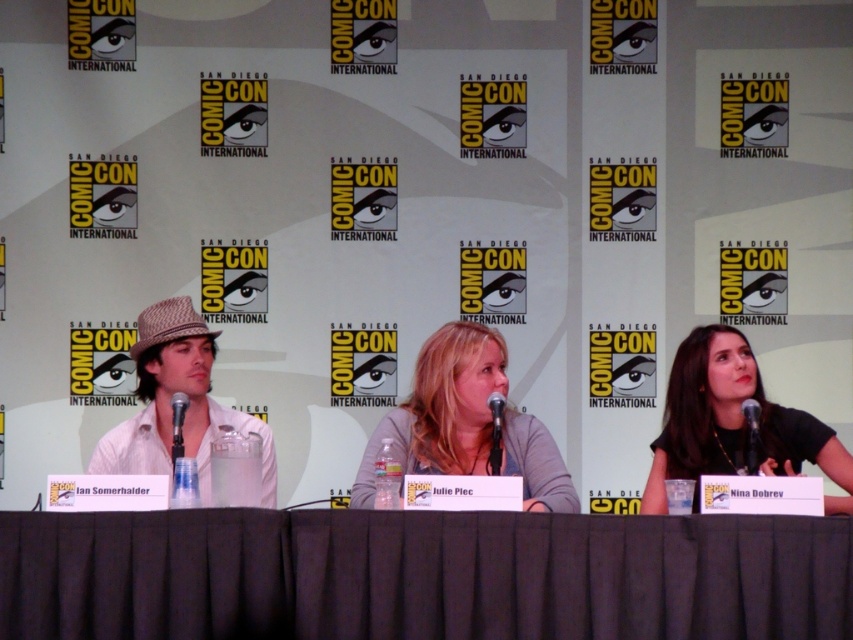
Can you confirm if dark fabric table at center is positioned to the right of light gray shirt at center?

In fact, dark fabric table at center is to the left of light gray shirt at center.

Where is `dark fabric table at center`? dark fabric table at center is located at coordinates (421, 576).

This screenshot has width=853, height=640. Identify the location of dark fabric table at center. (421, 576).

What do you see at coordinates (421, 576) in the screenshot?
I see `dark fabric table at center` at bounding box center [421, 576].

Is point (427, 602) positioned before point (112, 440)?

Yes, it is in front of point (112, 440).

Is point (819, 545) positioned behind point (161, 444)?

No.

What are the coordinates of `dark fabric table at center` in the screenshot? It's located at coord(421,576).

Is black matte shirt at right positioned before white cotton shirt at left?

No, it is not.

Is point (782, 464) closer to camera compared to point (183, 385)?

Yes, point (782, 464) is closer to viewer.

At what (x,y) coordinates should I click in order to perform the action: click on black matte shirt at right. Please return your answer as a coordinate pair (x, y). The image size is (853, 640). Looking at the image, I should click on (733, 422).